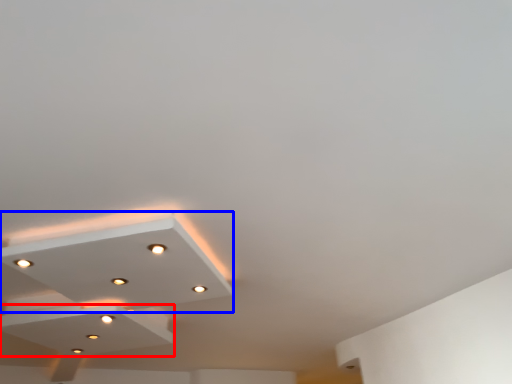
Question: Which of the following is the closest to the observer, exhaust hood (highlighted by a red box) or lamp (highlighted by a blue box)?

Choices:
 (A) exhaust hood
 (B) lamp

Answer: (B)